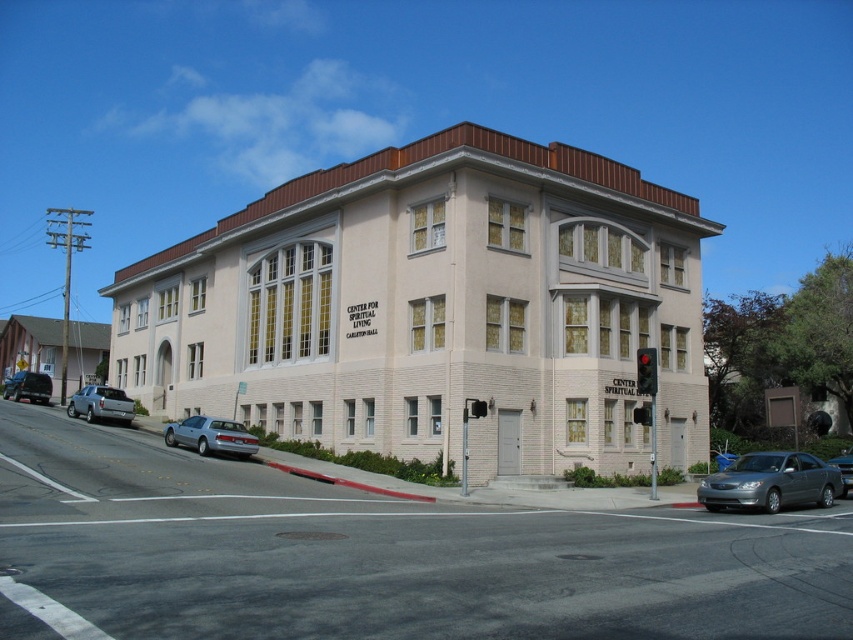
You are a delivery driver who needs to park your vehicle in the parking space in front of the CENTER FOR SPIRITUAL LIVING CARLETON HALL. The parking space can only accommodate vehicles smaller than the gray metallic sedan at lower right. Can your silver metallic suv at lower left fit in the space?

The gray metallic sedan at lower right is larger in size than the silver metallic suv at lower left. Since the parking space can only accommodate vehicles smaller than the gray metallic sedan at lower right, the silver metallic suv at lower left can fit in the space as it is smaller.

You are standing at the entrance of the CENTER FOR SPIRITUAL LIVING CARLETON HALL and want to walk to the traffic light on the right side. The traffic light is at point (376, 556). Is the path from the building entrance to the traffic light clear of any obstacles?

The point (376, 556) is on smooth asphalt road at center, so the path from the building entrance to the traffic light is clear of obstacles as it is on the asphalt road.